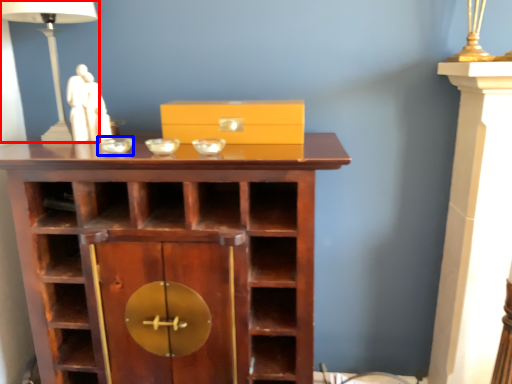
Question: Which point is closer to the camera, table lamp (highlighted by a red box) or glass bowl (highlighted by a blue box)?

Choices:
 (A) table lamp
 (B) glass bowl

Answer: (B)